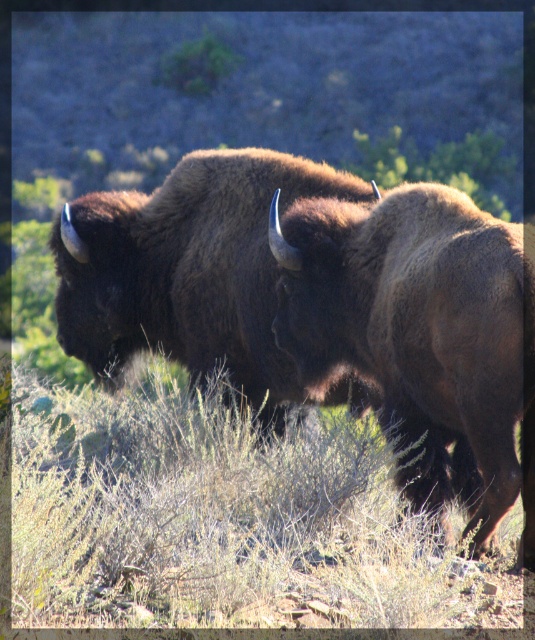
You are a photographer trying to capture both the dry grass at center and the brown fuzzy bison at center in the same frame. Based on their sizes, which object should you focus on to ensure both fit clearly in the photo?

The dry grass at center is larger than the brown fuzzy bison at center, so focusing on the dry grass at center will help ensure both fit clearly in the photo.